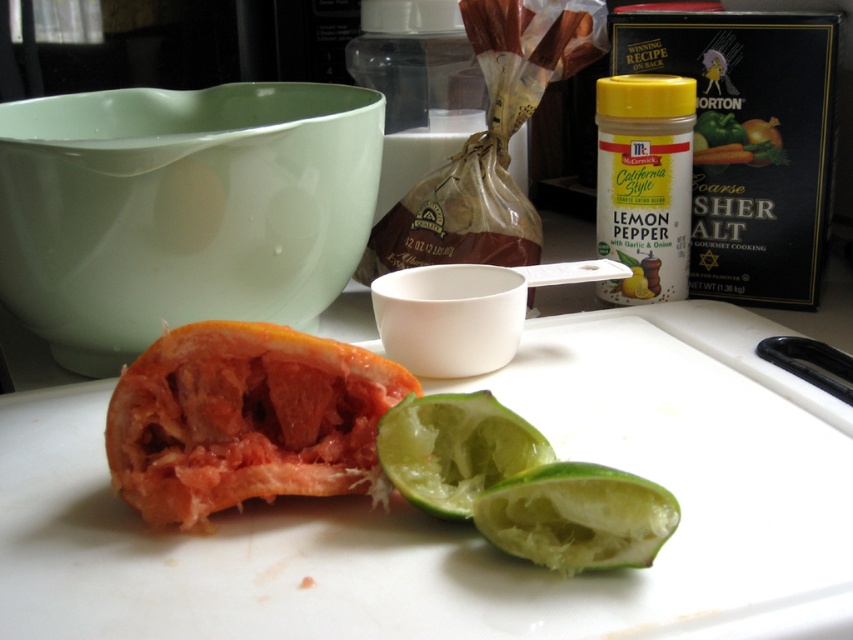
Who is taller, yellow plastic container at upper right or green matte lime at lower center?

yellow plastic container at upper right is taller.

Is point (650, 240) farther from camera compared to point (547, 548)?

Yes, it is behind point (547, 548).

Where is `yellow plastic container at upper right`? The image size is (853, 640). yellow plastic container at upper right is located at coordinates (643, 182).

Identify the location of yellow plastic container at upper right. This screenshot has width=853, height=640. (643, 182).

Which is behind, point (590, 492) or point (427, 403)?

Point (427, 403)

Is green matte lime at lower center shorter than green matte lime at center?

Correct, green matte lime at lower center is not as tall as green matte lime at center.

This screenshot has width=853, height=640. What do you see at coordinates (577, 516) in the screenshot? I see `green matte lime at lower center` at bounding box center [577, 516].

Find the location of a particular element. This screenshot has width=853, height=640. green matte lime at lower center is located at coordinates (577, 516).

Can you confirm if orange flesh at center is thinner than green matte pepper at upper right?

No.

Measure the distance between orange flesh at center and camera.

orange flesh at center and camera are 15.34 inches apart from each other.

Image resolution: width=853 pixels, height=640 pixels. Find the location of `orange flesh at center`. orange flesh at center is located at coordinates (244, 419).